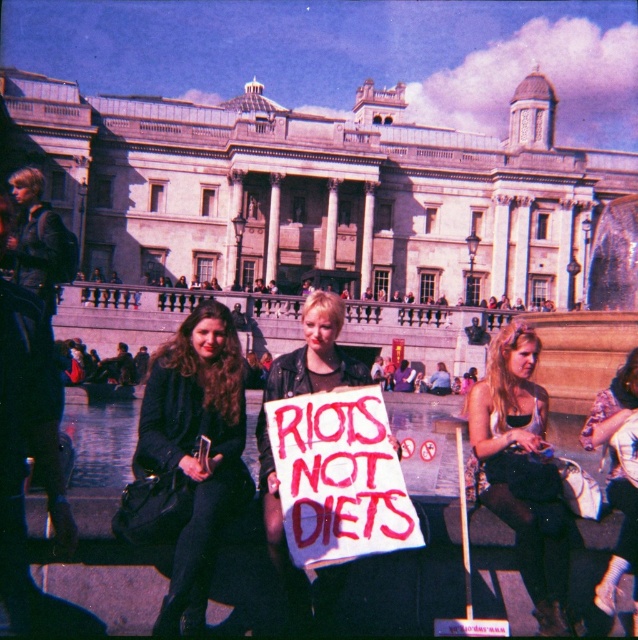
Question: Which of these objects is positioned farthest from the leather jacket at center?

Choices:
 (A) matte black tank top at center
 (B) matte black coat at center

Answer: (B)

Question: Does matte black coat at center appear on the left side of matte black tank top at center?

Choices:
 (A) yes
 (B) no

Answer: (A)

Question: Does matte black coat at center come behind matte black tank top at center?

Choices:
 (A) no
 (B) yes

Answer: (A)

Question: Based on their relative distances, which object is nearer to the matte black tank top at center?

Choices:
 (A) leather jacket at center
 (B) matte black coat at center

Answer: (A)

Question: Which object appears farthest from the camera in this image?

Choices:
 (A) matte black coat at center
 (B) leather jacket at center
 (C) matte black tank top at center

Answer: (B)

Question: Does matte black coat at center have a larger size compared to matte black tank top at center?

Choices:
 (A) no
 (B) yes

Answer: (B)